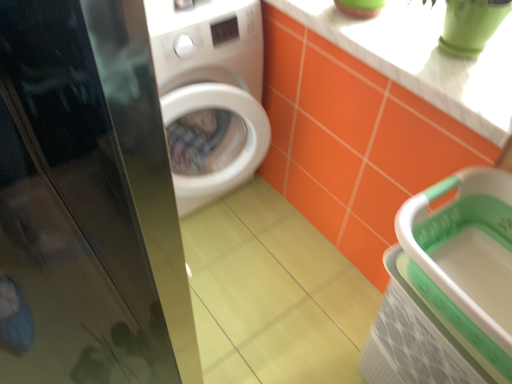
Identify the location of white glossy counter top at upper right. (423, 58).

At what (x,y) coordinates should I click in order to perform the action: click on green plastic basket at lower right. Please return your answer as a coordinate pair (x, y). Looking at the image, I should click on (448, 287).

From a real-world perspective, is glossy black screen door at left beneath white glossy counter top at upper right?

Incorrect, from a real-world perspective, glossy black screen door at left is higher than white glossy counter top at upper right.

Between glossy black screen door at left and white glossy counter top at upper right, which one appears on the left side from the viewer's perspective?

Positioned to the left is glossy black screen door at left.

Is there a large distance between glossy black screen door at left and white glossy counter top at upper right?

Actually, glossy black screen door at left and white glossy counter top at upper right are a little close together.

From the image's perspective, which one is positioned lower, white glossy counter top at upper right or glossy black screen door at left?

glossy black screen door at left appears lower in the image.

Considering the sizes of objects white glossy counter top at upper right and glossy black screen door at left in the image provided, who is shorter, white glossy counter top at upper right or glossy black screen door at left?

white glossy counter top at upper right is shorter.

The image size is (512, 384). Identify the location of counter top below the glossy black screen door at left (from a real-world perspective). (423, 58).

Is glossy black screen door at left at the back of white glossy counter top at upper right?

No.

Can you confirm if glossy black screen door at left is smaller than green plastic basket at lower right?

Correct, glossy black screen door at left occupies less space than green plastic basket at lower right.

Is glossy black screen door at left far away from green plastic basket at lower right?

glossy black screen door at left is near green plastic basket at lower right, not far away.

From the image's perspective, is glossy black screen door at left above or below green plastic basket at lower right?

glossy black screen door at left is above green plastic basket at lower right.

Does point (457, 300) come farther from viewer compared to point (318, 16)?

No, (457, 300) is in front of (318, 16).

Measure the distance between green plastic basket at lower right and white glossy counter top at upper right.

They are 14.99 inches apart.

Would you say green plastic basket at lower right is inside or outside white glossy counter top at upper right?

green plastic basket at lower right is not enclosed by white glossy counter top at upper right.

Does white glossy counter top at upper right contain green plastic basket at lower right?

Actually, green plastic basket at lower right is outside white glossy counter top at upper right.

Consider the image. Considering the relative sizes of white glossy counter top at upper right and green plastic basket at lower right in the image provided, is white glossy counter top at upper right bigger than green plastic basket at lower right?

Actually, white glossy counter top at upper right might be smaller than green plastic basket at lower right.

From a real-world perspective, which is physically below, white glossy counter top at upper right or green plastic basket at lower right?

green plastic basket at lower right.

Considering the points (426, 5) and (503, 303), which point is in front, point (426, 5) or point (503, 303)?

The point (503, 303) is in front.

Could you tell me if green plastic basket at lower right is facing glossy black screen door at left?

No, green plastic basket at lower right is not facing towards glossy black screen door at left.

How many degrees apart are the facing directions of green plastic basket at lower right and glossy black screen door at left?

green plastic basket at lower right and glossy black screen door at left are facing 90 degrees away from each other.

Who is smaller, green plastic basket at lower right or glossy black screen door at left?

With smaller size is glossy black screen door at left.

Based on the photo, from the image's perspective, which one is positioned lower, green plastic basket at lower right or glossy black screen door at left?

green plastic basket at lower right, from the image's perspective.

Find the location of a particular element. screen door located in front of the white glossy counter top at upper right is located at coordinates (87, 203).

Identify the location of screen door above the white glossy counter top at upper right (from a real-world perspective). (87, 203).

Considering their positions, is white glossy counter top at upper right positioned closer to green plastic basket at lower right than glossy black screen door at left?

The object closer to green plastic basket at lower right is white glossy counter top at upper right.

Based on the photo, estimate the real-world distances between objects in this image. Which object is closer to green plastic basket at lower right, glossy black screen door at left or white glossy counter top at upper right?

white glossy counter top at upper right is closer to green plastic basket at lower right.

Based on their spatial positions, is glossy black screen door at left or green plastic basket at lower right closer to white glossy counter top at upper right?

Among the two, green plastic basket at lower right is located nearer to white glossy counter top at upper right.

When comparing their distances from white glossy counter top at upper right, does green plastic basket at lower right or glossy black screen door at left seem further?

glossy black screen door at left lies further to white glossy counter top at upper right than the other object.

When comparing their distances from glossy black screen door at left, does green plastic basket at lower right or white glossy counter top at upper right seem closer?

green plastic basket at lower right is closer to glossy black screen door at left.

From the image, which object appears to be farther from glossy black screen door at left, white glossy counter top at upper right or green plastic basket at lower right?

white glossy counter top at upper right.

Where is `counter top between glossy black screen door at left and green plastic basket at lower right`? This screenshot has height=384, width=512. counter top between glossy black screen door at left and green plastic basket at lower right is located at coordinates (423, 58).